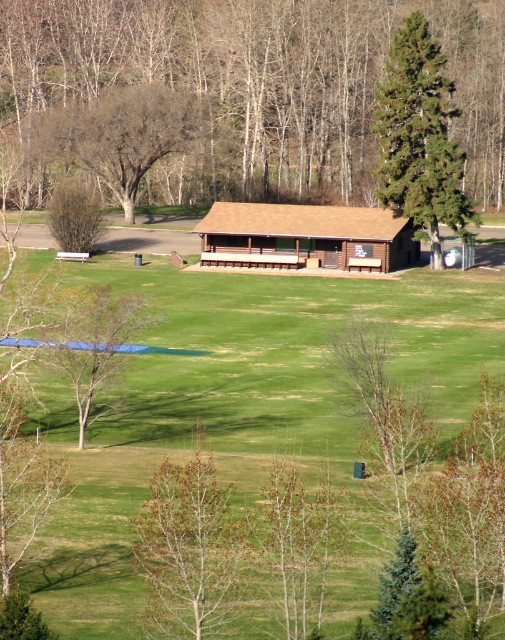
You are standing at the entrance of the wooden structure and want to walk towards the point that is closer to the bench under the porch. Which point should you head towards, point (x=193, y=460) or point (x=135, y=106)?

Point (x=193, y=460) is in front of point (x=135, y=106), so you should head towards point (x=193, y=460) as it is closer to the bench under the porch.

You are standing in the grassy field near the wooden structure. You see the brown smooth tree at lower center and the brown leafless tree at lower left. Which tree is positioned to the right of the other?

The brown smooth tree at lower center is positioned to the right of the brown leafless tree at lower left.